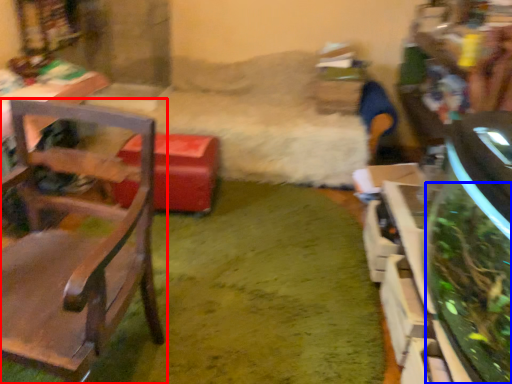
Question: Which object appears farthest to the camera in this image, chair (highlighted by a red box) or plant (highlighted by a blue box)?

Choices:
 (A) chair
 (B) plant

Answer: (B)